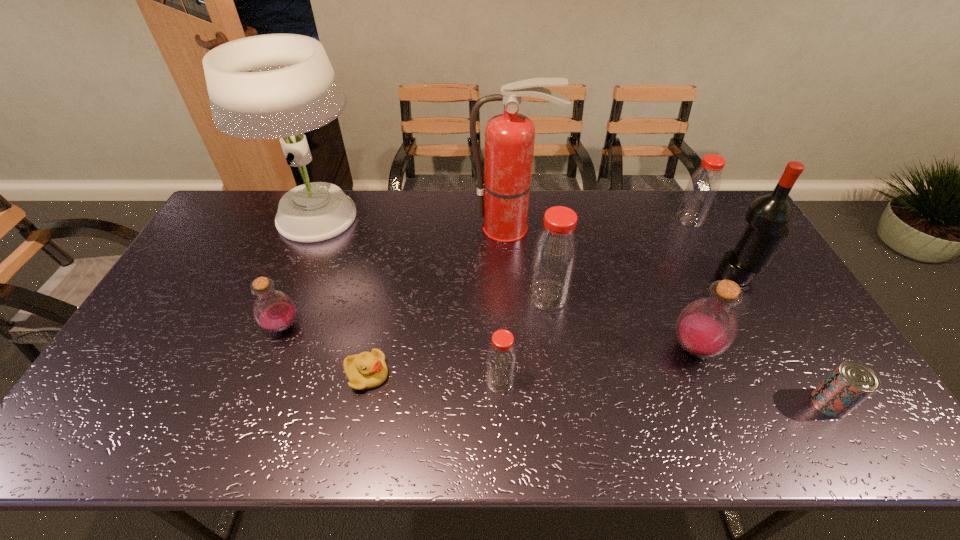
Find the location of `free spot that satisfies the following two spatial constraints: 1. with the handle and hose on the red fire extinguisher; 2. on the right side of the red beer can`. free spot that satisfies the following two spatial constraints: 1. with the handle and hose on the red fire extinguisher; 2. on the right side of the red beer can is located at coordinates (525, 403).